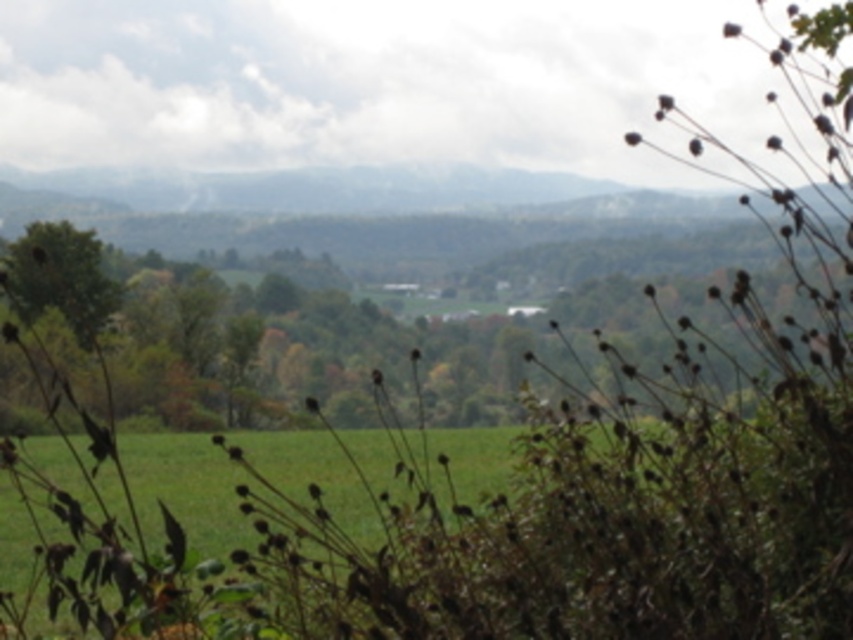
You are standing in the middle of the field and see the green matte tree at center and the green grass at center. Which object is positioned to the right of the other?

The green matte tree at center is to the right of the green grass at center.

You are standing at the edge of the field and want to walk towards the dense collection of trees in the midground. Is the green grass at center in your path?

The green grass at center is located at point (186, 484), which would be in your path as you walk towards the dense collection of trees in the midground.

You are standing in the rural landscape and want to take a photo of the green matte tree at center and the green leafy tree at left. Which tree should you focus on first if you want to capture both in one shot without moving your camera?

The green matte tree at center is below the green leafy tree at left, so you should focus on the green leafy tree at left first since it is higher up and closer to the top of the frame, allowing both trees to be included in the shot.